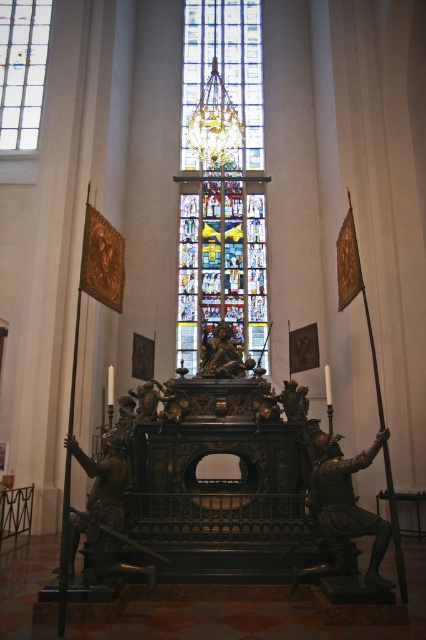
You are standing inside a cathedral and want to touch the clear glass stained glass at upper center. Given that you can jump up to 2 feet high, can you reach it?

The clear glass stained glass at upper center is 285.84 feet away from you, so no, you cannot reach it with a jump of only 2 feet.

You are standing in the cathedral and want to take a photo of the bronze statue at right. To avoid the multicolored stained glass at center reflecting in the statue, which direction should you position yourself relative to the stained glass?

Position yourself to the right of the multicolored stained glass at center so that the bronze statue at right is between you and the stained glass, blocking its reflection.